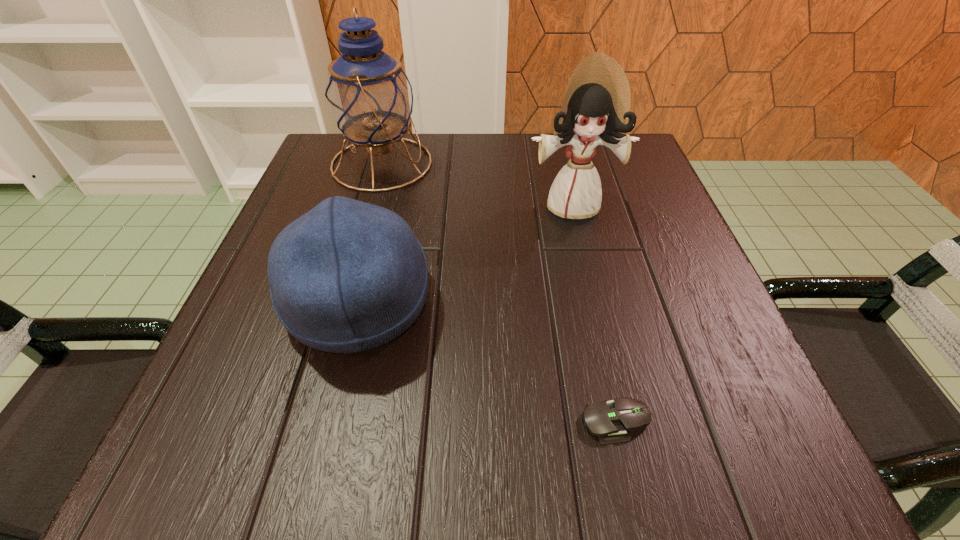
This screenshot has width=960, height=540. I want to click on lantern that is positioned at the far edge, so click(x=369, y=97).

Identify the location of doll situated at the far edge. (596, 106).

I want to click on object that is at the near edge, so click(610, 420).

At what (x,y) coordinates should I click in order to perform the action: click on lantern located in the left edge section of the desktop. Please return your answer as a coordinate pair (x, y). Looking at the image, I should click on (369, 97).

Locate an element on the screen. This screenshot has height=540, width=960. skullcap present at the left edge is located at coordinates (347, 276).

This screenshot has width=960, height=540. What are the coordinates of `doll that is positioned at the right edge` in the screenshot? It's located at (596, 106).

Locate an element on the screen. This screenshot has height=540, width=960. computer mouse located in the right edge section of the desktop is located at coordinates (610, 420).

Find the location of a particular element. This screenshot has height=540, width=960. object positioned at the far left corner is located at coordinates (369, 97).

This screenshot has height=540, width=960. I want to click on object located in the far right corner section of the desktop, so click(596, 106).

Where is `object that is at the near right corner`? The height and width of the screenshot is (540, 960). object that is at the near right corner is located at coordinates (610, 420).